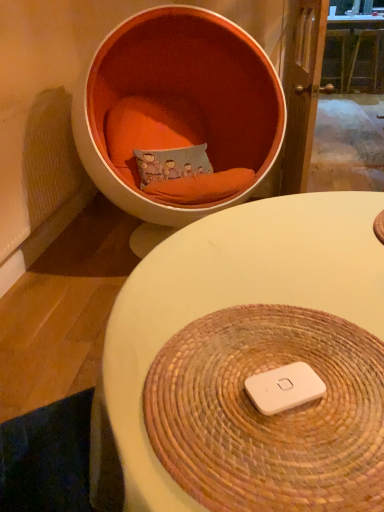
Locate an element on the screen. vacant space to the left of white matte/ipod at center is located at coordinates (183, 389).